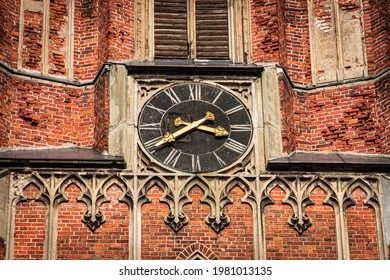
I want to click on clock hour hand, so 216,130.